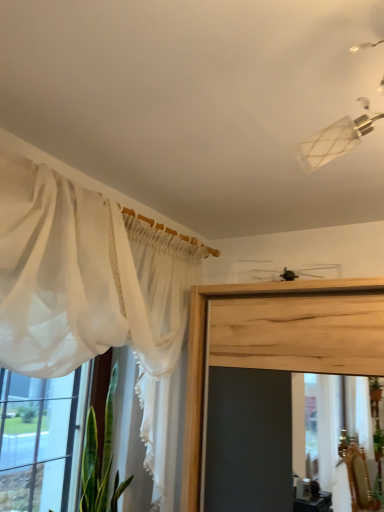
Question: Can you confirm if sheer white curtain at left is wider than sheer white curtain at left?

Choices:
 (A) no
 (B) yes

Answer: (B)

Question: From a real-world perspective, does sheer white curtain at left stand above sheer white curtain at left?

Choices:
 (A) no
 (B) yes

Answer: (B)

Question: Is sheer white curtain at left bigger than sheer white curtain at left?

Choices:
 (A) no
 (B) yes

Answer: (B)

Question: Considering the relative positions of sheer white curtain at left and sheer white curtain at left in the image provided, is sheer white curtain at left in front of sheer white curtain at left?

Choices:
 (A) yes
 (B) no

Answer: (A)

Question: Can you confirm if sheer white curtain at left is thinner than sheer white curtain at left?

Choices:
 (A) no
 (B) yes

Answer: (A)

Question: Is sheer white curtain at left positioned beyond the bounds of sheer white curtain at left?

Choices:
 (A) yes
 (B) no

Answer: (A)

Question: From the image's perspective, would you say sheer white curtain at left is positioned over sheer white curtain at left?

Choices:
 (A) yes
 (B) no

Answer: (B)

Question: Does sheer white curtain at left have a lesser height compared to sheer white curtain at left?

Choices:
 (A) yes
 (B) no

Answer: (A)

Question: Is the position of sheer white curtain at left less distant than that of sheer white curtain at left?

Choices:
 (A) no
 (B) yes

Answer: (A)

Question: Can you confirm if sheer white curtain at left is bigger than sheer white curtain at left?

Choices:
 (A) yes
 (B) no

Answer: (B)

Question: Does sheer white curtain at left lie behind sheer white curtain at left?

Choices:
 (A) no
 (B) yes

Answer: (B)

Question: Is sheer white curtain at left thinner than sheer white curtain at left?

Choices:
 (A) no
 (B) yes

Answer: (B)

Question: From the image's perspective, is sheer white curtain at left located above or below sheer white curtain at left?

Choices:
 (A) below
 (B) above

Answer: (B)